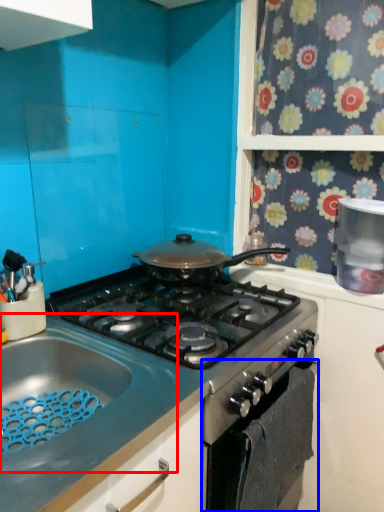
Question: Which of the following is the farthest to the observer, sink (highlighted by a red box) or oven (highlighted by a blue box)?

Choices:
 (A) sink
 (B) oven

Answer: (B)